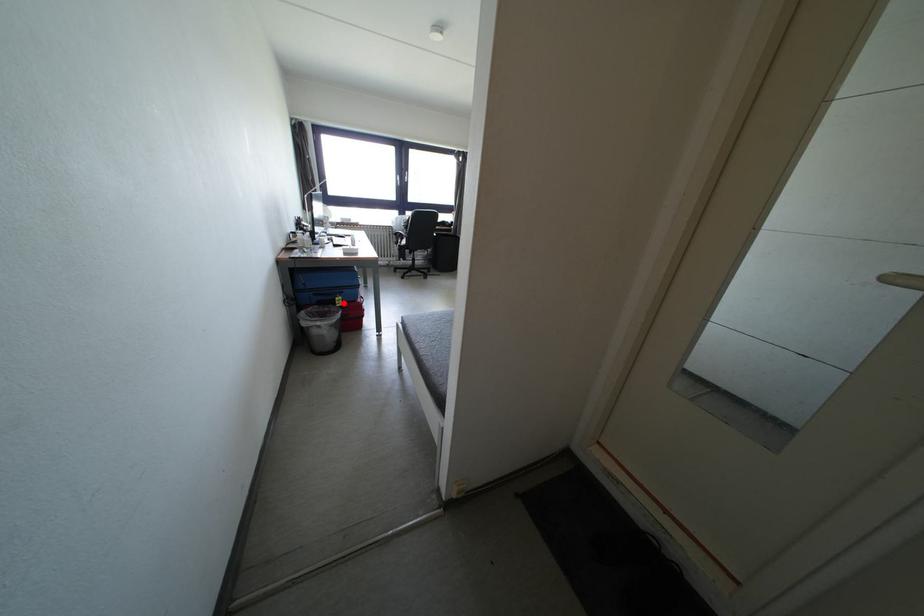
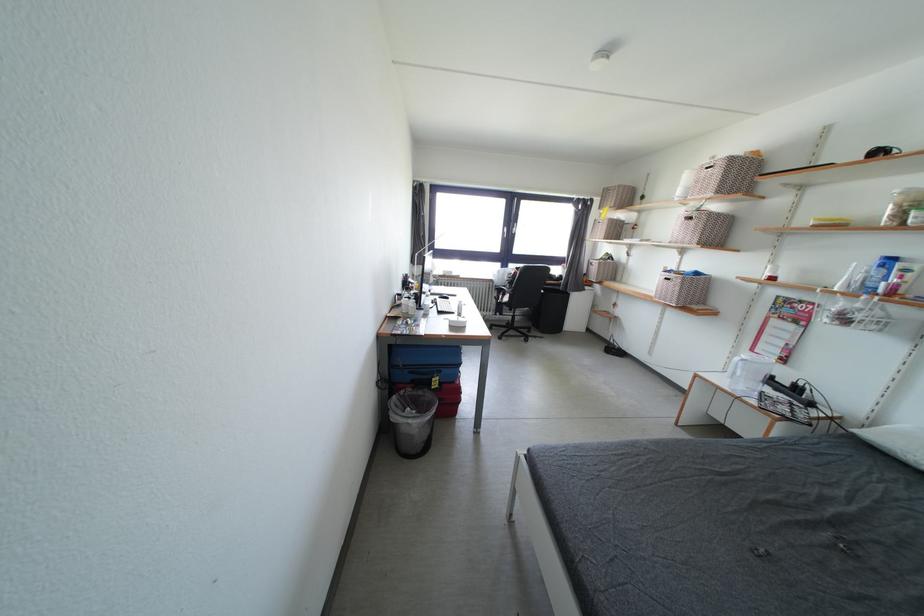
The point at the highlighted location is marked in the first image. Where is the corresponding point in the second image?

(440, 384)